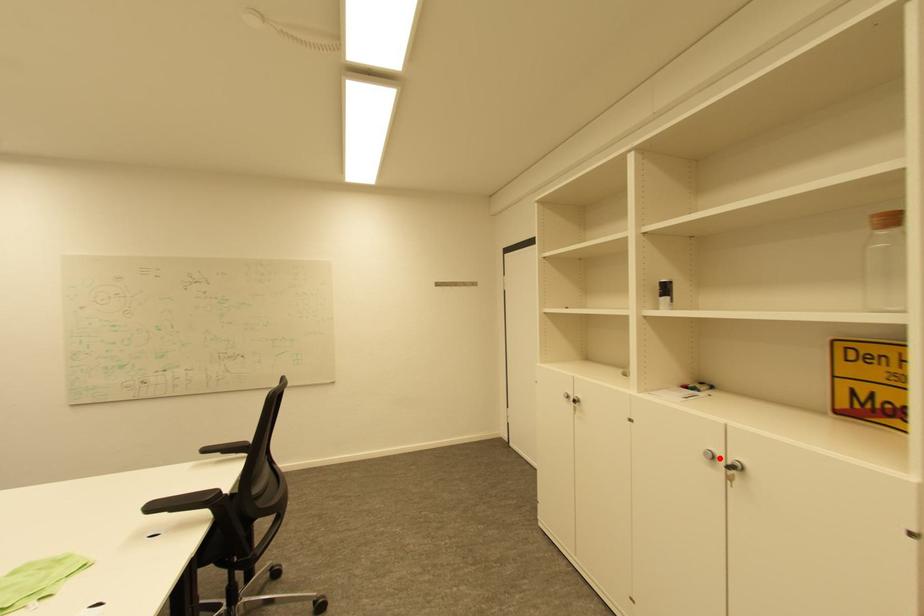
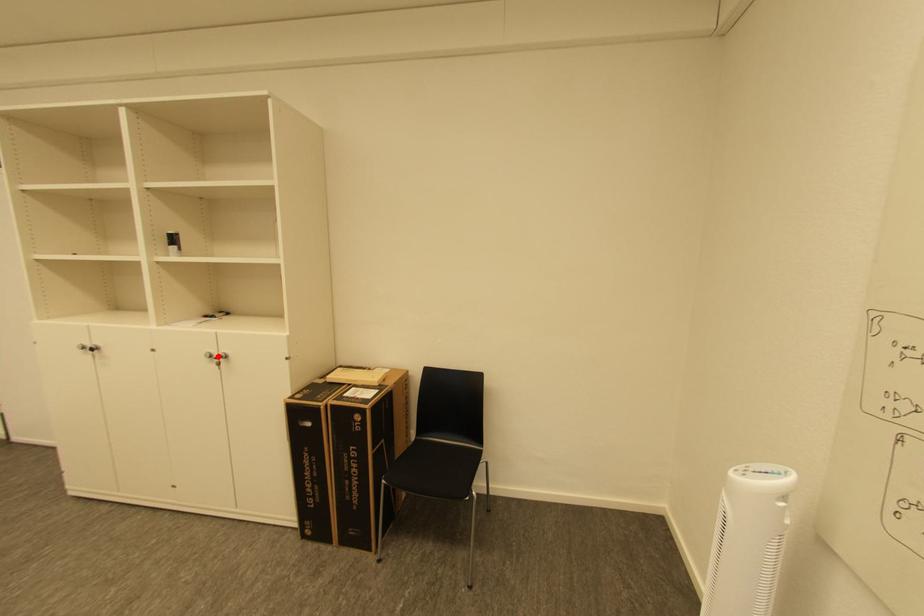
I am providing you with two images of the same scene from different viewpoints. A red point is marked on the first image and another point is marked on the second image. Is the red point in image1 aligned with the point shown in image2?

Yes